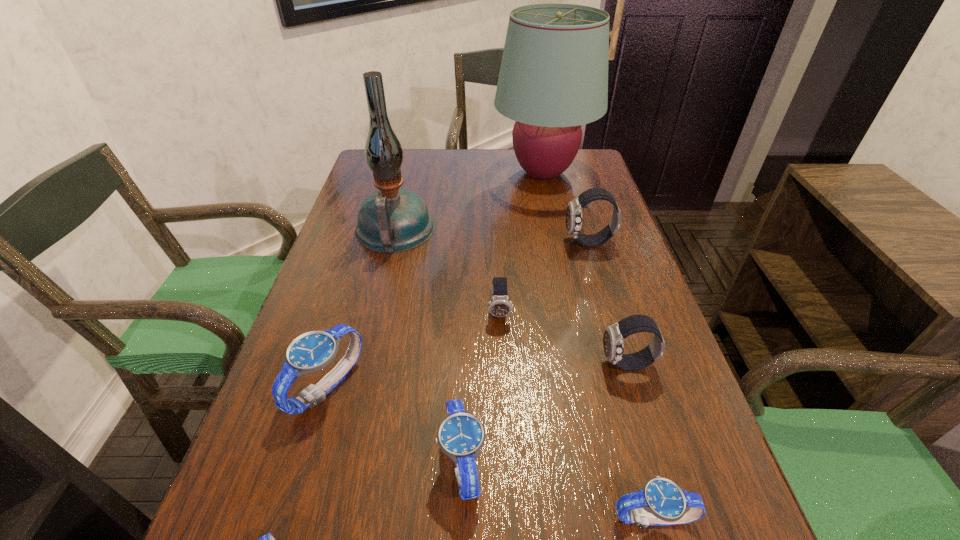
What are the coordinates of `vacant point located 0.220m on the left of the second biggest blue watch` in the screenshot? It's located at (302, 462).

In order to click on free spot located on the face of the leftmost dark watch in this screenshot , I will do `click(506, 452)`.

At what (x,y) coordinates should I click in order to perform the action: click on object that is at the far edge. Please return your answer as a coordinate pair (x, y). This screenshot has width=960, height=540. Looking at the image, I should click on 553,78.

Identify the location of oil lamp that is positioned at the left edge. (392, 220).

I want to click on watch located in the left edge section of the desktop, so point(313,351).

Where is `lampshade situated at the right edge`? This screenshot has width=960, height=540. lampshade situated at the right edge is located at coordinates (553, 78).

Where is `object situated at the far right corner`? This screenshot has width=960, height=540. object situated at the far right corner is located at coordinates (553, 78).

At what (x,y) coordinates should I click in order to perform the action: click on free space at the far edge of the desktop. Please return your answer as a coordinate pair (x, y). Looking at the image, I should click on (521, 171).

Locate an element on the screen. The width and height of the screenshot is (960, 540). free location at the left edge is located at coordinates (326, 260).

Locate an element on the screen. Image resolution: width=960 pixels, height=540 pixels. vacant space at the right edge of the desktop is located at coordinates (611, 441).